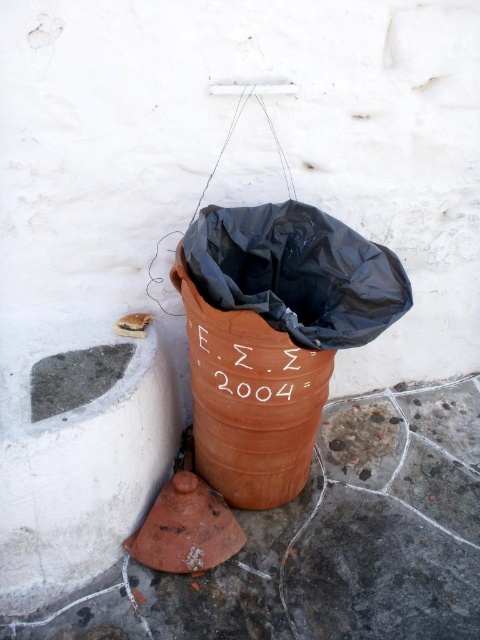
Question: Does smooth concrete pavement at lower left appear over terracotta textured barrel at center?

Choices:
 (A) no
 (B) yes

Answer: (A)

Question: Which object is farther from the camera taking this photo?

Choices:
 (A) smooth concrete pavement at lower left
 (B) terracotta textured barrel at center

Answer: (A)

Question: Does smooth concrete pavement at lower left have a larger size compared to terracotta textured barrel at center?

Choices:
 (A) yes
 (B) no

Answer: (A)

Question: Does smooth concrete pavement at lower left have a smaller size compared to terracotta textured barrel at center?

Choices:
 (A) no
 (B) yes

Answer: (A)

Question: Which point appears closest to the camera in this image?

Choices:
 (A) (238, 445)
 (B) (477, 596)

Answer: (B)